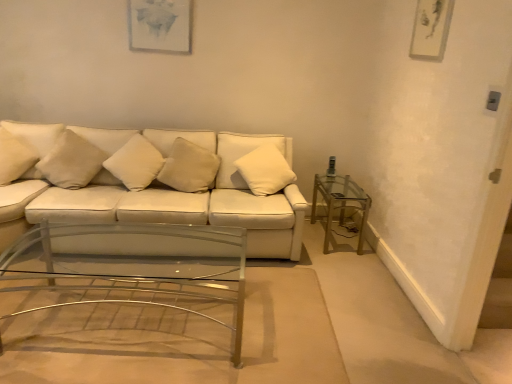
Question: Can we say white soft cushion at center, the third pillow positioned from the left, lies outside white leather couch at center?

Choices:
 (A) yes
 (B) no

Answer: (B)

Question: From the image's perspective, is white soft cushion at center, the third pillow positioned from the left, on white leather couch at center?

Choices:
 (A) yes
 (B) no

Answer: (A)

Question: Can you confirm if white soft cushion at center, the third pillow positioned from the left, is wider than white leather couch at center?

Choices:
 (A) yes
 (B) no

Answer: (B)

Question: From a real-world perspective, is white soft cushion at center, the third pillow positioned from the left, physically above white leather couch at center?

Choices:
 (A) no
 (B) yes

Answer: (B)

Question: Can you confirm if white soft cushion at center, which ranks as the 3th pillow in right-to-left order, is thinner than white leather couch at center?

Choices:
 (A) no
 (B) yes

Answer: (B)

Question: Is white soft cushion at center, which ranks as the 3th pillow in right-to-left order, to the right of white leather couch at center from the viewer's perspective?

Choices:
 (A) yes
 (B) no

Answer: (B)

Question: From the image's perspective, is beige fabric pillow at center, which is the 4th pillow from left to right, on top of white leather couch at center?

Choices:
 (A) yes
 (B) no

Answer: (A)

Question: Is beige fabric pillow at center, arranged as the 2th pillow when viewed from the right, to the left of white leather couch at center from the viewer's perspective?

Choices:
 (A) yes
 (B) no

Answer: (B)

Question: Does beige fabric pillow at center, arranged as the 2th pillow when viewed from the right, have a greater width compared to white leather couch at center?

Choices:
 (A) yes
 (B) no

Answer: (B)

Question: Is beige fabric pillow at center, arranged as the 2th pillow when viewed from the right, further to the viewer compared to white leather couch at center?

Choices:
 (A) yes
 (B) no

Answer: (A)

Question: Is beige fabric pillow at center, which is the 4th pillow from left to right, positioned with its back to white leather couch at center?

Choices:
 (A) no
 (B) yes

Answer: (B)

Question: Is white soft pillow at center, the 1th pillow from the right, oriented towards beige fabric pillow at left, the second pillow when ordered from left to right?

Choices:
 (A) no
 (B) yes

Answer: (A)